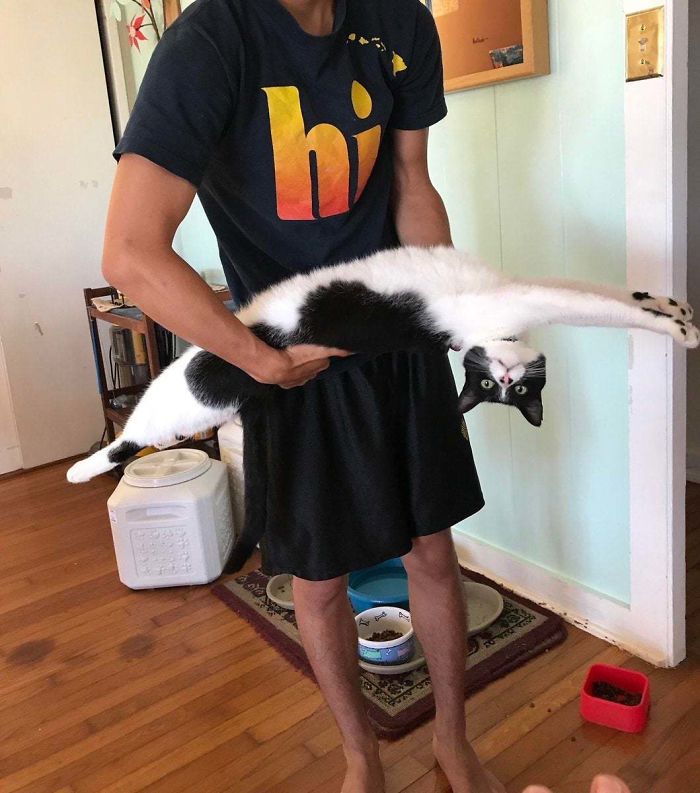
Identify the location of plate. (483, 613).